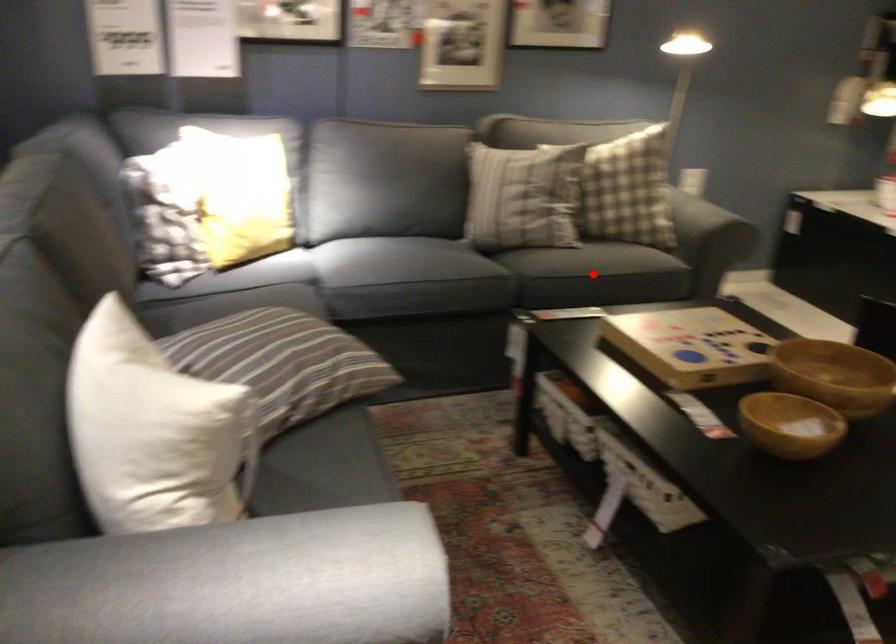
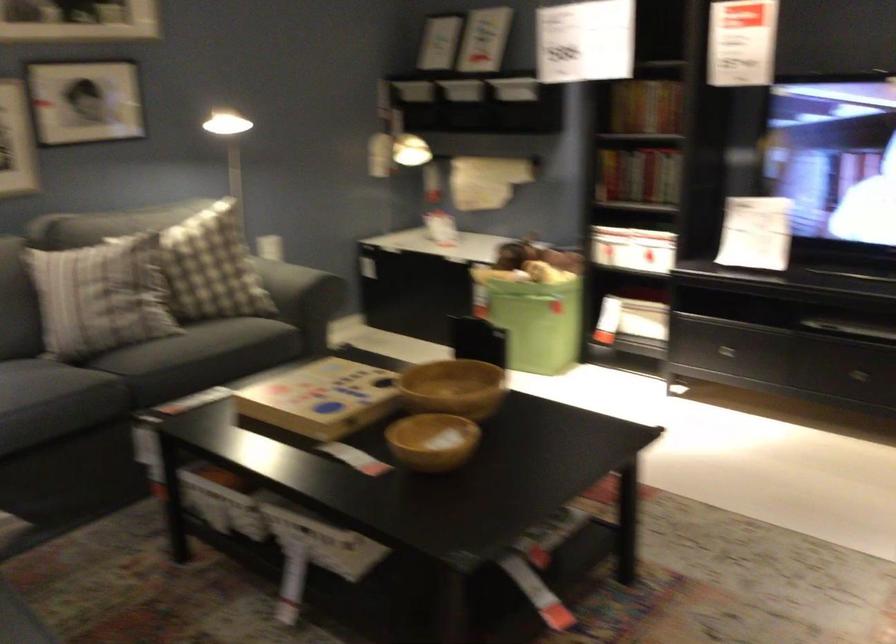
Locate, in the second image, the point that corresponds to the highlighted location in the first image.

(199, 357)